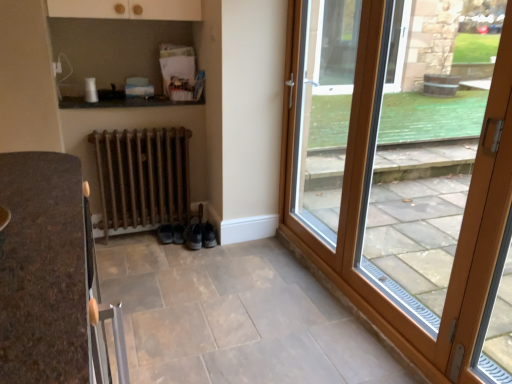
Question: Does rusty metal radiator at lower center have a larger size compared to wooden glass door at right, the 2th door in the right-to-left sequence?

Choices:
 (A) yes
 (B) no

Answer: (B)

Question: Does rusty metal radiator at lower center have a lesser height compared to wooden glass door at right, the 2th door in the right-to-left sequence?

Choices:
 (A) yes
 (B) no

Answer: (A)

Question: Does rusty metal radiator at lower center appear on the right side of wooden glass door at right, the 2th door in the right-to-left sequence?

Choices:
 (A) yes
 (B) no

Answer: (B)

Question: Is rusty metal radiator at lower center thinner than wooden glass door at right, the 2th door in the right-to-left sequence?

Choices:
 (A) yes
 (B) no

Answer: (B)

Question: Is rusty metal radiator at lower center positioned beyond the bounds of wooden glass door at right, the first door positioned from the left?

Choices:
 (A) no
 (B) yes

Answer: (B)

Question: From their relative heights in the image, would you say leather black shoe at lower center, marked as the first shoe in a right-to-left arrangement, is taller or shorter than wooden door at right, which is the 1th door from right to left?

Choices:
 (A) short
 (B) tall

Answer: (A)

Question: In terms of width, does leather black shoe at lower center, marked as the first shoe in a right-to-left arrangement, look wider or thinner when compared to wooden door at right, which is the 1th door from right to left?

Choices:
 (A) wide
 (B) thin

Answer: (A)

Question: From the image's perspective, is leather black shoe at lower center, marked as the first shoe in a right-to-left arrangement, above or below wooden door at right, which is the 1th door from right to left?

Choices:
 (A) below
 (B) above

Answer: (A)

Question: Looking at the image, does leather black shoe at lower center, marked as the first shoe in a right-to-left arrangement, seem bigger or smaller compared to wooden door at right, which ranks as the second door in left-to-right order?

Choices:
 (A) big
 (B) small

Answer: (B)

Question: From the image's perspective, relative to wooden glass door at right, the 2th door in the right-to-left sequence, is wooden door at right, which is the 1th door from right to left, above or below?

Choices:
 (A) above
 (B) below

Answer: (B)

Question: From a real-world perspective, is wooden door at right, which ranks as the second door in left-to-right order, physically located above or below wooden glass door at right, the first door positioned from the left?

Choices:
 (A) above
 (B) below

Answer: (B)

Question: In the image, is wooden door at right, which ranks as the second door in left-to-right order, on the left side or the right side of wooden glass door at right, the 2th door in the right-to-left sequence?

Choices:
 (A) left
 (B) right

Answer: (B)

Question: Which is correct: wooden door at right, which is the 1th door from right to left, is inside wooden glass door at right, the 2th door in the right-to-left sequence, or outside of it?

Choices:
 (A) inside
 (B) outside

Answer: (A)

Question: Is wooden door at right, which is the 1th door from right to left, wider or thinner than rusty metal radiator at lower center?

Choices:
 (A) wide
 (B) thin

Answer: (B)

Question: From a real-world perspective, is wooden door at right, which ranks as the second door in left-to-right order, above or below rusty metal radiator at lower center?

Choices:
 (A) below
 (B) above

Answer: (B)